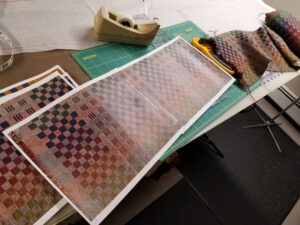
Locate an element on the screen. This screenshot has height=225, width=300. radiator on wall is located at coordinates (281, 95).